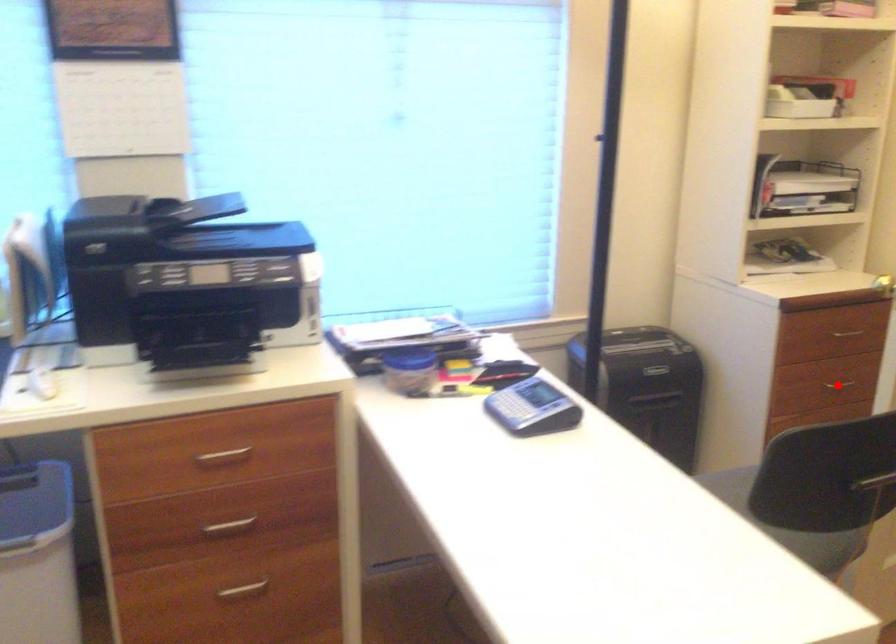
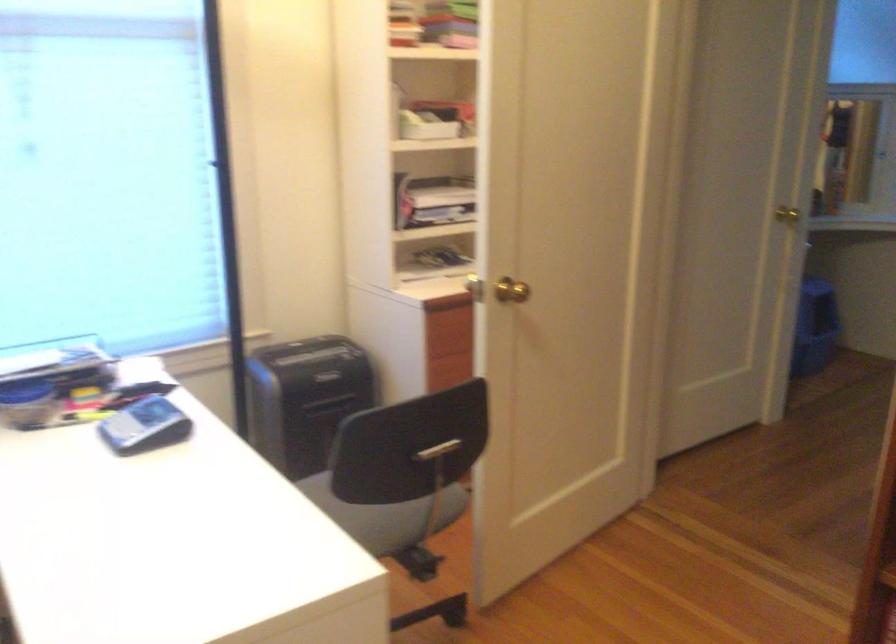
Question: I am providing you with two images of the same scene from different viewpoints. A red point is marked on the first image. Can you still see the location of the red point in image 2?

Choices:
 (A) Yes
 (B) No

Answer: (B)